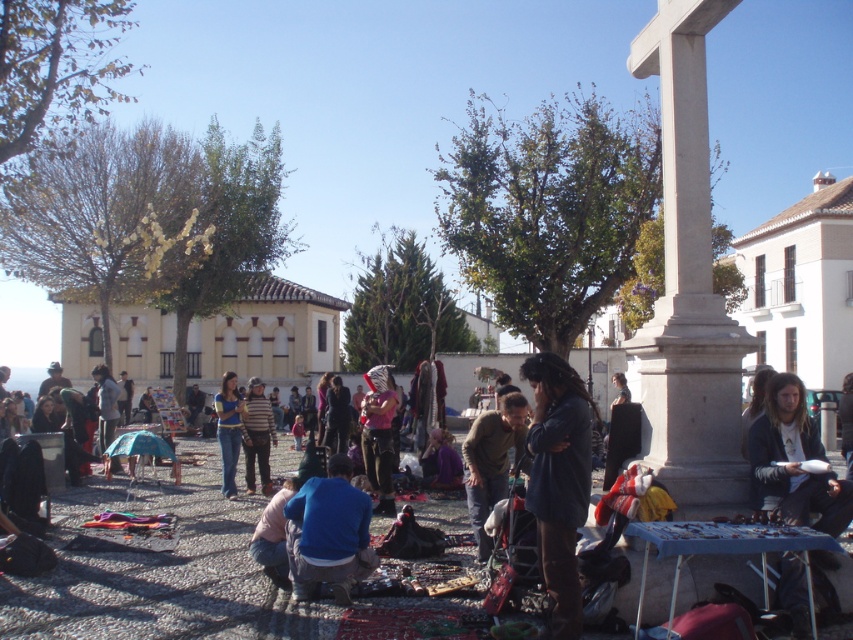
You are standing at the center of the market square and want to take a photo of both points. Which point, point [463,456] or point [251,404], is closer to your camera lens?

Point [463,456] is closer to the camera than point [251,404].

You are a photographer standing at the edge of the market square. You notice two people wearing a matte pink shirt at center and a striped knit sweater at center. Which clothing item is closer to you?

The matte pink shirt at center is closer because it is in front of the striped knit sweater at center.